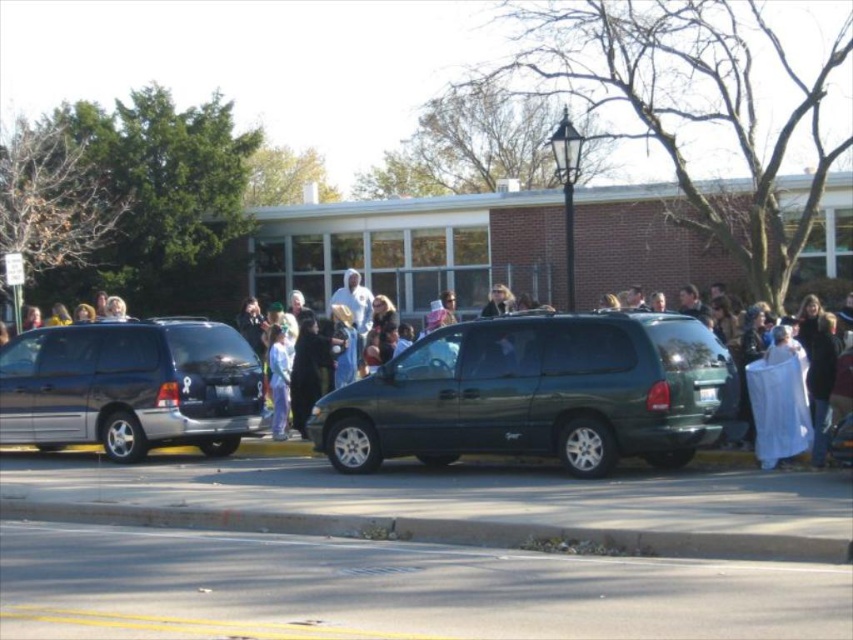
You are a pedestrian standing on the sidewalk and want to take a photo of the green matte van at center without including the matte black clothing at center in the frame. Is it possible to do so by adjusting your position?

The matte black clothing at center is located above the green matte van at center, so if you position yourself lower or move to a side angle where the clothing is out of the frame, you can capture the van without the clothing.

You are a delivery person who needs to place a package on the smooth concrete curb at lower center. However, there is a person wearing matte black clothing at center nearby. Can you safely place the package on the curb without the person reaching it?

The matte black clothing at center and smooth concrete curb at lower center are 3.66 meters apart from each other. Since the distance is over 3 meters, the person cannot reach the curb from their position, so placing the package there is safe.

You are a delivery person who needs to park your 4.0 meter long truck between the shiny metallic minivan at center and the smooth concrete curb at lower center. Is there enough space for your truck?

The shiny metallic minivan at center is 3.97 meters from the smooth concrete curb at lower center. Since the truck is 4.0 meters long, it is slightly longer than the available space. Therefore, the truck cannot fit between the shiny metallic minivan at center and the smooth concrete curb at lower center.